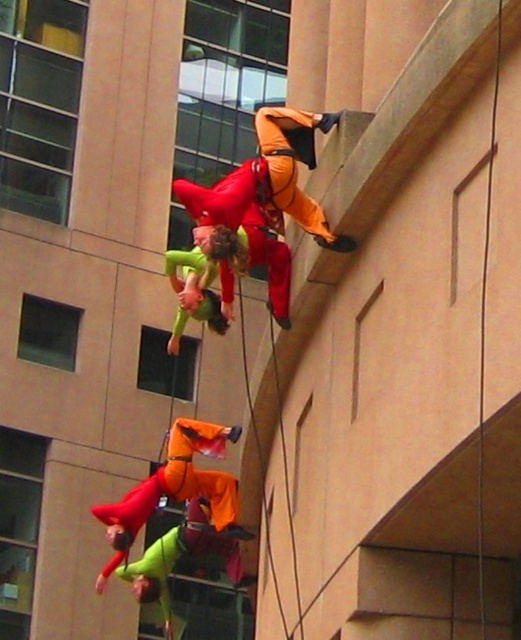
Question: In this image, where is orange fabric acrobat at center located relative to orange fabric person at center?

Choices:
 (A) right
 (B) left

Answer: (A)

Question: Is neon green fabric at lower center smaller than green matte/synthetic suit at center?

Choices:
 (A) yes
 (B) no

Answer: (B)

Question: From the image, what is the correct spatial relationship of orange fabric acrobat at center in relation to orange fabric person at center?

Choices:
 (A) right
 (B) left

Answer: (A)

Question: Considering the real-world distances, which object is closest to the orange fabric acrobat at center?

Choices:
 (A) green matte/synthetic suit at center
 (B) neon green fabric at lower center
 (C) orange fabric person at center

Answer: (A)

Question: Which object is farther from the camera taking this photo?

Choices:
 (A) neon green fabric at lower center
 (B) green matte/synthetic suit at center
 (C) orange fabric acrobat at center

Answer: (A)

Question: Which point is closer to the camera taking this photo?

Choices:
 (A) (205, 556)
 (B) (203, 262)

Answer: (B)